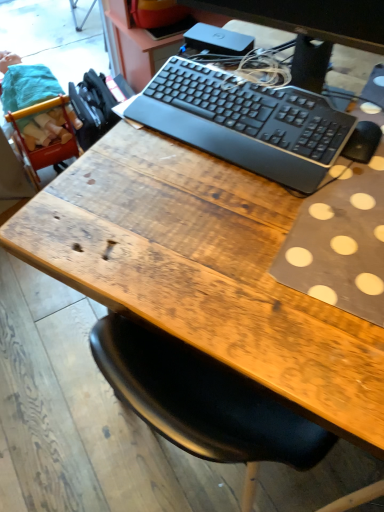
Question: In terms of width, does black plastic keyboard at upper center look wider or thinner when compared to black plastic keyboard at center?

Choices:
 (A) wide
 (B) thin

Answer: (B)

Question: Is point (327, 19) closer or farther from the camera than point (286, 179)?

Choices:
 (A) farther
 (B) closer

Answer: (B)

Question: Would you say black plastic keyboard at upper center is to the left or to the right of black plastic keyboard at center in the picture?

Choices:
 (A) right
 (B) left

Answer: (A)

Question: Is point pos(253,159) positioned closer to the camera than point pos(311,76)?

Choices:
 (A) farther
 (B) closer

Answer: (B)

Question: Is black plastic keyboard at center wider or thinner than black plastic keyboard at upper center?

Choices:
 (A) thin
 (B) wide

Answer: (B)

Question: From a real-world perspective, relative to black plastic keyboard at upper center, is black plastic keyboard at center vertically above or below?

Choices:
 (A) above
 (B) below

Answer: (B)

Question: Relative to black plastic keyboard at upper center, is black plastic keyboard at center in front or behind?

Choices:
 (A) behind
 (B) front

Answer: (A)